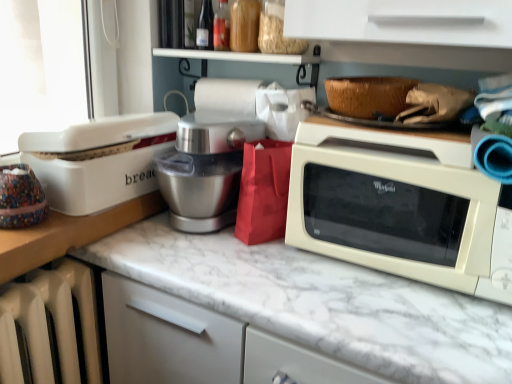
Question: From a real-world perspective, is white marble countertop at center over woven brown basket at upper right?

Choices:
 (A) yes
 (B) no

Answer: (B)

Question: Does white marble countertop at center lie behind woven brown basket at upper right?

Choices:
 (A) no
 (B) yes

Answer: (A)

Question: Is white marble countertop at center positioned in front of woven brown basket at upper right?

Choices:
 (A) no
 (B) yes

Answer: (B)

Question: From the image's perspective, does white marble countertop at center appear higher than woven brown basket at upper right?

Choices:
 (A) no
 (B) yes

Answer: (A)

Question: Is white marble countertop at center looking in the opposite direction of woven brown basket at upper right?

Choices:
 (A) yes
 (B) no

Answer: (B)

Question: Considering the positions of white marble countertop at center and translucent glass bottle at upper center in the image, is white marble countertop at center wider or thinner than translucent glass bottle at upper center?

Choices:
 (A) thin
 (B) wide

Answer: (B)

Question: In terms of height, does white marble countertop at center look taller or shorter compared to translucent glass bottle at upper center?

Choices:
 (A) tall
 (B) short

Answer: (A)

Question: Does point (485, 331) appear closer or farther from the camera than point (202, 4)?

Choices:
 (A) farther
 (B) closer

Answer: (B)

Question: Is white marble countertop at center to the left or to the right of translucent glass bottle at upper center in the image?

Choices:
 (A) right
 (B) left

Answer: (A)

Question: Which is correct: white plastic bread box at left is inside translucent glass bottle at upper center, or outside of it?

Choices:
 (A) inside
 (B) outside

Answer: (B)

Question: Is point (143, 130) closer or farther from the camera than point (206, 44)?

Choices:
 (A) farther
 (B) closer

Answer: (B)

Question: From their relative heights in the image, would you say white plastic bread box at left is taller or shorter than translucent glass bottle at upper center?

Choices:
 (A) short
 (B) tall

Answer: (B)

Question: Based on their positions, is white plastic bread box at left located to the left or right of translucent glass bottle at upper center?

Choices:
 (A) left
 (B) right

Answer: (A)

Question: In the image, is translucent glass bottle at upper center positioned in front of or behind white glossy microwave at right?

Choices:
 (A) behind
 (B) front

Answer: (A)

Question: Is point (206, 8) positioned closer to the camera than point (418, 279)?

Choices:
 (A) farther
 (B) closer

Answer: (A)